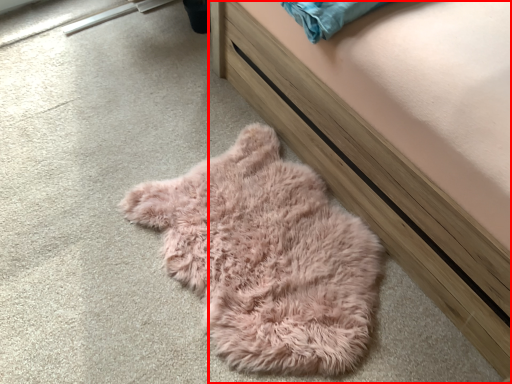
Question: From the image's perspective, considering the relative positions of furniture (annotated by the red box) and sleeping bag in the image provided, where is furniture (annotated by the red box) located with respect to the staircase?

Choices:
 (A) below
 (B) above

Answer: (B)